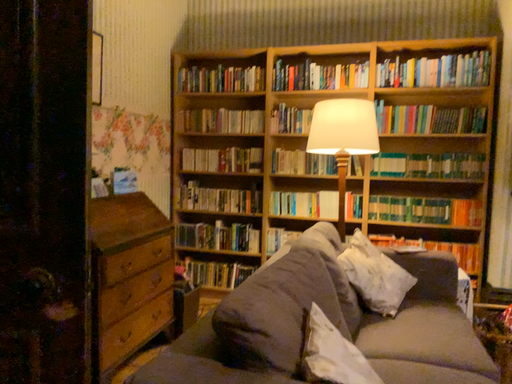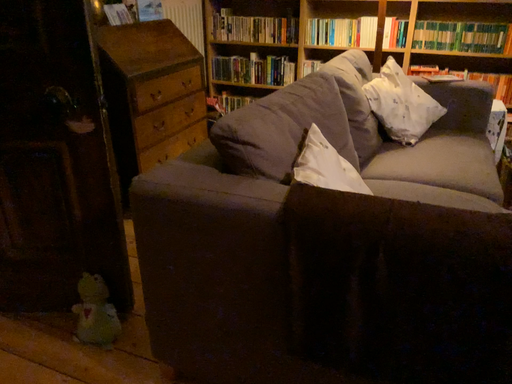
Question: How did the camera likely rotate when shooting the video?

Choices:
 (A) rotated left
 (B) rotated right

Answer: (A)